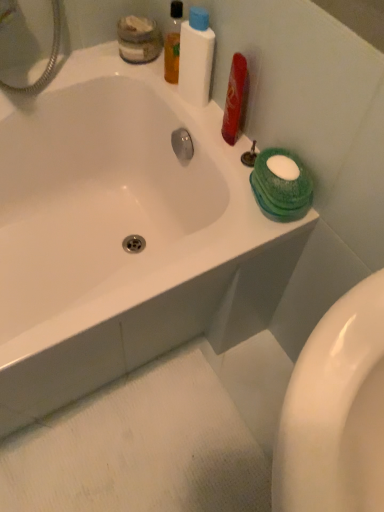
Question: From the image's perspective, relative to matte glass jar at upper left, is white plastic bottle at upper center above or below?

Choices:
 (A) above
 (B) below

Answer: (B)

Question: From a real-world perspective, is white plastic bottle at upper center above or below matte glass jar at upper left?

Choices:
 (A) above
 (B) below

Answer: (A)

Question: Considering the real-world distances, which object is closest to the white plastic bottle at upper center?

Choices:
 (A) matte glass jar at upper left
 (B) white glossy bathtub at upper center
 (C) translucent plastic mouthwash at upper center

Answer: (C)

Question: Estimate the real-world distances between objects in this image. Which object is closer to the white glossy bathtub at upper center?

Choices:
 (A) white plastic bottle at upper center
 (B) matte glass jar at upper left
 (C) translucent plastic mouthwash at upper center

Answer: (A)